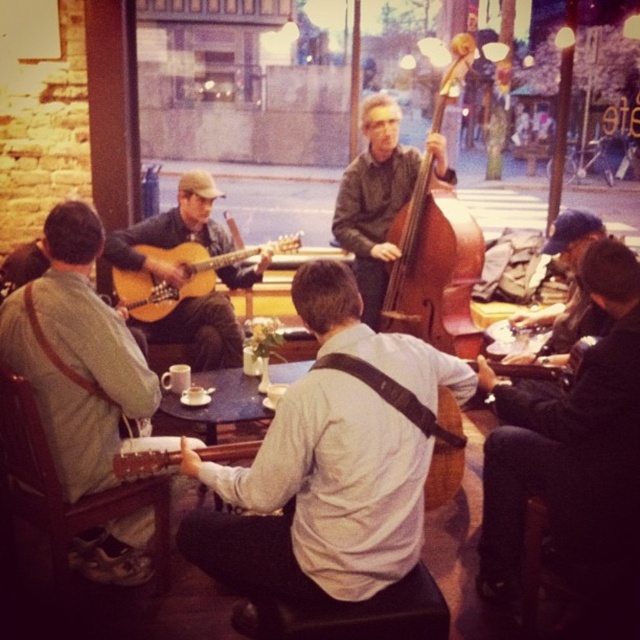
What is the position of the brown wooden cello at center in the image?

The brown wooden cello at center is located at point (433, 266).